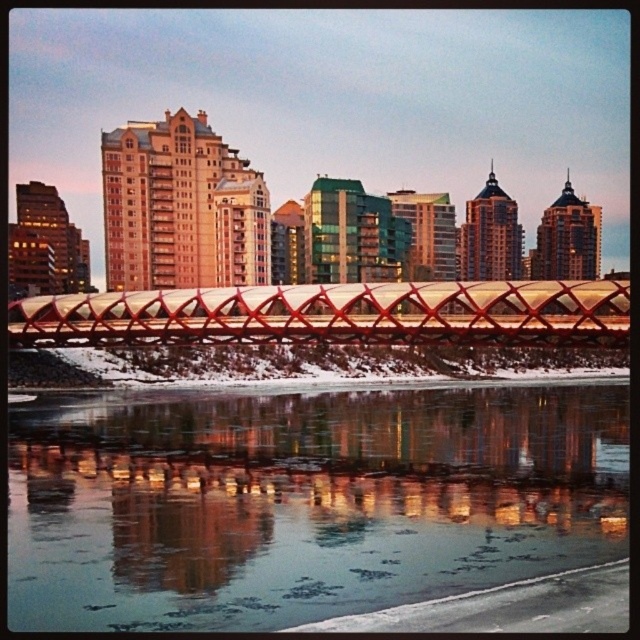
Does point (592, 452) come closer to viewer compared to point (108, 310)?

Yes, point (592, 452) is closer to viewer.

Between frozen glassy water at lower center and metallic red bridge at center, which one is positioned lower?

frozen glassy water at lower center

Which is behind, point (589, 403) or point (170, 330)?

The point (589, 403) is more distant.

At what (x,y) coordinates should I click in order to perform the action: click on frozen glassy water at lower center. Please return your answer as a coordinate pair (x, y). Looking at the image, I should click on (305, 500).